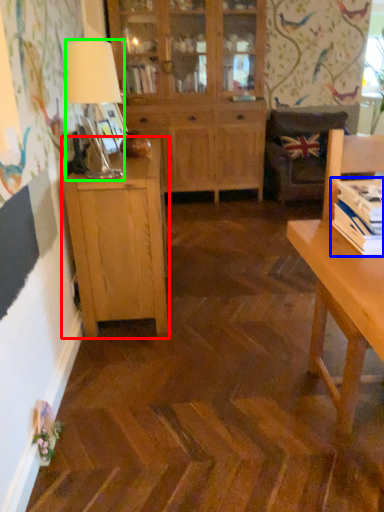
Question: Considering the real-world distances, which object is farthest from cabinetry (highlighted by a red box)? book (highlighted by a blue box) or table lamp (highlighted by a green box)?

Choices:
 (A) book
 (B) table lamp

Answer: (A)